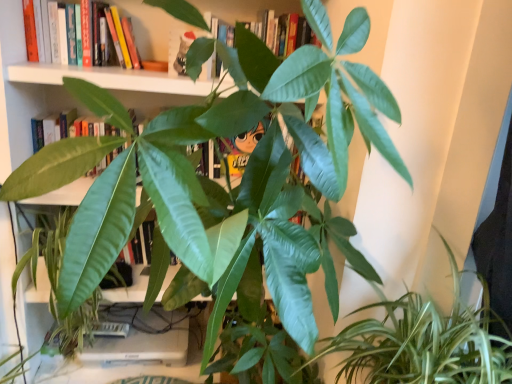
Where is `green glossy leafy plant at lower right`? The width and height of the screenshot is (512, 384). green glossy leafy plant at lower right is located at coordinates (423, 342).

What do you see at coordinates (423, 342) in the screenshot? I see `green glossy leafy plant at lower right` at bounding box center [423, 342].

Looking at this image, in order to face green glossy leafy plant at lower right, should I rotate leftwards or rightwards?

Rotate your view right by about 22.734°.

This screenshot has height=384, width=512. What do you see at coordinates (65, 33) in the screenshot?
I see `hardcover book at upper left` at bounding box center [65, 33].

The width and height of the screenshot is (512, 384). Find the location of `hardcover book at upper left`. hardcover book at upper left is located at coordinates (65, 33).

Locate an element on the screen. Image resolution: width=512 pixels, height=384 pixels. green glossy leafy plant at lower right is located at coordinates (423, 342).

Can you confirm if hardcover book at upper left is positioned to the left of green glossy leafy plant at lower right?

Yes.

Considering the positions of objects hardcover book at upper left and green glossy leafy plant at lower right in the image provided, who is in front, hardcover book at upper left or green glossy leafy plant at lower right?

Positioned in front is green glossy leafy plant at lower right.

Which is closer to the camera, [73,33] or [334,351]?

Clearly, point [73,33] is more distant from the camera than point [334,351].

From the image's perspective, is hardcover book at upper left positioned above or below green glossy leafy plant at lower right?

Based on their image positions, hardcover book at upper left is located above green glossy leafy plant at lower right.

From a real-world perspective, is hardcover book at upper left physically above green glossy leafy plant at lower right?

Correct, in the physical world, hardcover book at upper left is higher than green glossy leafy plant at lower right.

Is hardcover book at upper left wider or thinner than green glossy leafy plant at lower right?

hardcover book at upper left is thinner than green glossy leafy plant at lower right.

Is hardcover book at upper left shorter than green glossy leafy plant at lower right?

Yes.

Can you confirm if hardcover book at upper left is bigger than green glossy leafy plant at lower right?

No.

Is hardcover book at upper left not within green glossy leafy plant at lower right?

Yes, hardcover book at upper left is not within green glossy leafy plant at lower right.

Is hardcover book at upper left far away from green glossy leafy plant at lower right?

Absolutely, hardcover book at upper left is distant from green glossy leafy plant at lower right.

Is hardcover book at upper left facing towards green glossy leafy plant at lower right?

No, hardcover book at upper left is not oriented towards green glossy leafy plant at lower right.

From the picture: What's the angular difference between hardcover book at upper left and green glossy leafy plant at lower right's facing directions?

The angular difference between hardcover book at upper left and green glossy leafy plant at lower right is 84.1 degrees.

Locate an element on the screen. The width and height of the screenshot is (512, 384). houseplant below the hardcover book at upper left (from a real-world perspective) is located at coordinates (423, 342).

Is green glossy leafy plant at lower right to the left of hardcover book at upper left from the viewer's perspective?

No.

Is green glossy leafy plant at lower right closer to the viewer compared to hardcover book at upper left?

Yes, green glossy leafy plant at lower right is closer to the camera.

Is point (373, 369) closer or farther from the camera than point (56, 40)?

Point (373, 369).

From the image's perspective, is green glossy leafy plant at lower right beneath hardcover book at upper left?

Correct, green glossy leafy plant at lower right appears lower than hardcover book at upper left in the image.

From a real-world perspective, is green glossy leafy plant at lower right on top of hardcover book at upper left?

Actually, green glossy leafy plant at lower right is physically below hardcover book at upper left in the real world.

Between green glossy leafy plant at lower right and hardcover book at upper left, which one has larger width?

green glossy leafy plant at lower right is wider.

Can you confirm if green glossy leafy plant at lower right is shorter than hardcover book at upper left?

In fact, green glossy leafy plant at lower right may be taller than hardcover book at upper left.

Is green glossy leafy plant at lower right smaller than hardcover book at upper left?

Actually, green glossy leafy plant at lower right might be larger than hardcover book at upper left.

Is hardcover book at upper left surrounded by green glossy leafy plant at lower right?

No, hardcover book at upper left is not surrounded by green glossy leafy plant at lower right.

Is green glossy leafy plant at lower right directly adjacent to hardcover book at upper left?

green glossy leafy plant at lower right is not next to hardcover book at upper left, and they're not touching.

Could you tell me if green glossy leafy plant at lower right is facing hardcover book at upper left?

No, green glossy leafy plant at lower right is not oriented towards hardcover book at upper left.

How different are the orientations of green glossy leafy plant at lower right and hardcover book at upper left in degrees?

The angular difference between green glossy leafy plant at lower right and hardcover book at upper left is 84.1 degrees.

This screenshot has height=384, width=512. What are the coordinates of `book lying above the green glossy leafy plant at lower right (from the image's perspective)` in the screenshot? It's located at (65, 33).

Where is `book behind the green glossy leafy plant at lower right`? The width and height of the screenshot is (512, 384). book behind the green glossy leafy plant at lower right is located at coordinates (65, 33).

Locate an element on the screen. The width and height of the screenshot is (512, 384). book on the left of green glossy leafy plant at lower right is located at coordinates (65, 33).